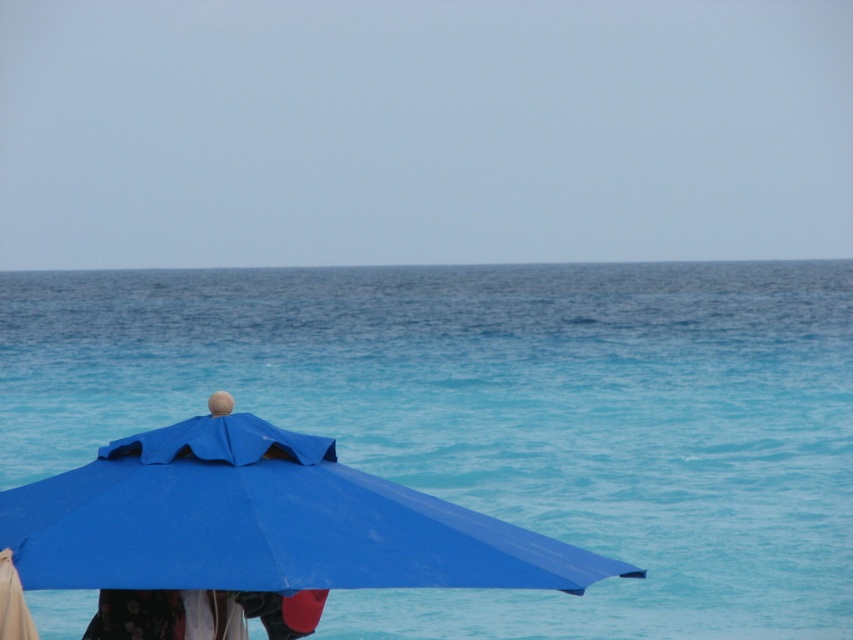
Is blue water at center to the right of blue fabric umbrella at lower left from the viewer's perspective?

In fact, blue water at center is to the left of blue fabric umbrella at lower left.

Which is below, blue water at center or blue fabric umbrella at lower left?

blue fabric umbrella at lower left

Which is behind, point (270, 372) or point (33, 524)?

Positioned behind is point (270, 372).

In order to click on blue water at center in this screenshot , I will do `click(498, 417)`.

Does blue water at center have a greater width compared to floral fabric dress at lower left?

Indeed, blue water at center has a greater width compared to floral fabric dress at lower left.

Is blue water at center shorter than floral fabric dress at lower left?

No, blue water at center is not shorter than floral fabric dress at lower left.

You are a GUI agent. You are given a task and a screenshot of the screen. Output one action in this format:
    pyautogui.click(x=<x>, y=<y>)
    Task: Click on the blue water at center
    This screenshot has height=640, width=853.
    Given the screenshot: What is the action you would take?
    pyautogui.click(x=498, y=417)

Is point (287, 534) in front of point (178, 595)?

Yes.

The height and width of the screenshot is (640, 853). What do you see at coordinates (254, 532) in the screenshot? I see `blue fabric umbrella at lower left` at bounding box center [254, 532].

This screenshot has width=853, height=640. I want to click on blue fabric umbrella at lower left, so click(254, 532).